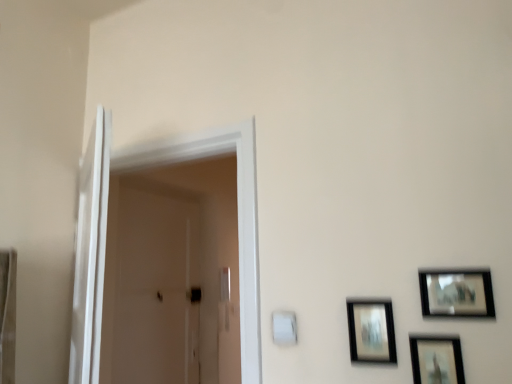
Question: Does white glossy door at left appear on the right side of white glossy door at left, placed as the first screen door when sorted from back to front?

Choices:
 (A) no
 (B) yes

Answer: (B)

Question: Is white glossy door at left wider than white glossy door at left, placed as the first screen door when sorted from back to front?

Choices:
 (A) yes
 (B) no

Answer: (A)

Question: Is white glossy door at left touching white glossy door at left, placed as the first screen door when sorted from back to front?

Choices:
 (A) yes
 (B) no

Answer: (B)

Question: Is white glossy door at left taller than white glossy door at left, the 2th screen door in the front-to-back sequence?

Choices:
 (A) no
 (B) yes

Answer: (A)

Question: Could you tell me if white glossy door at left is turned towards white glossy door at left, the 2th screen door in the front-to-back sequence?

Choices:
 (A) yes
 (B) no

Answer: (B)

Question: Would you say matte black picture frame at lower right, the 3th picture frame when ordered from right to left, is inside or outside matte black picture frame at lower right, marked as the second picture frame in a right-to-left arrangement?

Choices:
 (A) inside
 (B) outside

Answer: (B)

Question: Considering the relative positions of matte black picture frame at lower right, the 3th picture frame when ordered from right to left, and matte black picture frame at lower right, marked as the second picture frame in a right-to-left arrangement, in the image provided, is matte black picture frame at lower right, the 3th picture frame when ordered from right to left, to the left or to the right of matte black picture frame at lower right, marked as the second picture frame in a right-to-left arrangement,?

Choices:
 (A) right
 (B) left

Answer: (B)

Question: Considering the positions of matte black picture frame at lower right, placed as the first picture frame when sorted from left to right, and matte black picture frame at lower right, the second picture frame viewed from the left, in the image, is matte black picture frame at lower right, placed as the first picture frame when sorted from left to right, taller or shorter than matte black picture frame at lower right, the second picture frame viewed from the left,?

Choices:
 (A) tall
 (B) short

Answer: (A)

Question: Based on their sizes in the image, would you say matte black picture frame at lower right, placed as the first picture frame when sorted from left to right, is bigger or smaller than matte black picture frame at lower right, the second picture frame viewed from the left?

Choices:
 (A) big
 (B) small

Answer: (A)

Question: In terms of width, does matte black picture frame at lower right, marked as the second picture frame in a right-to-left arrangement, look wider or thinner when compared to white glossy door at left?

Choices:
 (A) thin
 (B) wide

Answer: (A)

Question: From their relative heights in the image, would you say matte black picture frame at lower right, the second picture frame viewed from the left, is taller or shorter than white glossy door at left?

Choices:
 (A) tall
 (B) short

Answer: (B)

Question: From a real-world perspective, is matte black picture frame at lower right, marked as the second picture frame in a right-to-left arrangement, above or below white glossy door at left?

Choices:
 (A) above
 (B) below

Answer: (B)

Question: Is point (423, 357) positioned closer to the camera than point (201, 155)?

Choices:
 (A) farther
 (B) closer

Answer: (B)

Question: From a real-world perspective, is white glossy door at left positioned above or below white glossy screen door at left, the 1th screen door positioned from the front?

Choices:
 (A) below
 (B) above

Answer: (B)

Question: From the image's perspective, is white glossy door at left above or below white glossy screen door at left, the 1th screen door positioned from the front?

Choices:
 (A) below
 (B) above

Answer: (A)